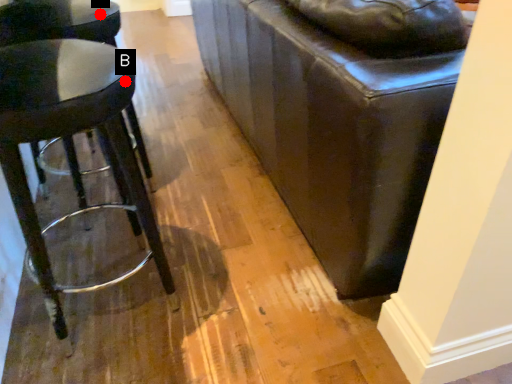
Question: Two points are circled on the image, labeled by A and B beside each circle. Among these points, which one is nearest to the camera?

Choices:
 (A) A is closer
 (B) B is closer

Answer: (B)